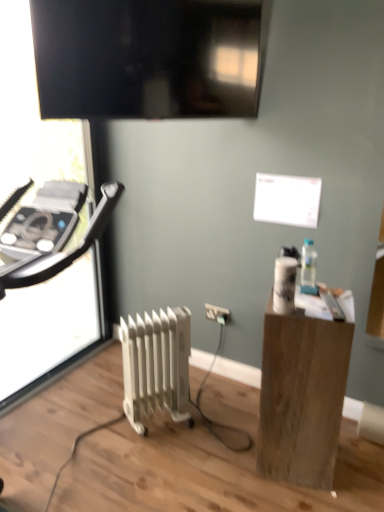
Identify the location of vacant space in front of white metallic radiator at center. (157, 463).